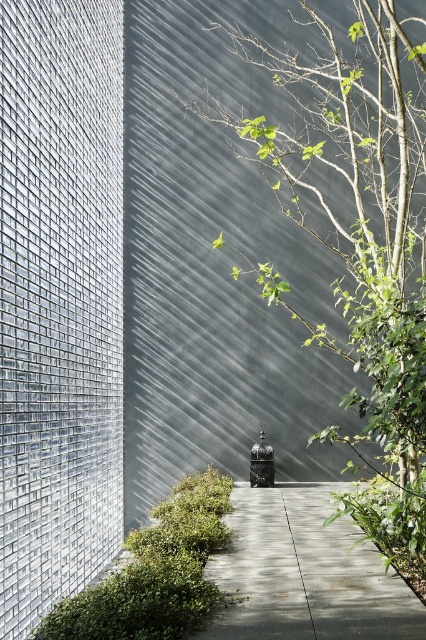
You are standing at the point marked by the coordinates point (305, 573). Which direction should you walk to reach the dark gray wall with horizontal lines in the center right?

The gray concrete path at center is represented by point (305, 573). Since the dark gray wall with horizontal lines is in the center right, you should walk towards the right along the path to reach it.

You are standing at the center of the paved pathway in the modern architectural scene. You see two points marked on the image. Which point is closer to you, point (417, 634) or point (158, 552)?

Point (417, 634) is closer to the camera than point (158, 552), so it is closer to you.

You are standing on the paved pathway in the middle of the scene. You see a green leafy tree at center and a green leafy hedge at lower left. Which of these two plants is positioned higher up in the image?

The green leafy tree at center is located above the green leafy hedge at lower left, so it is positioned higher up in the image.